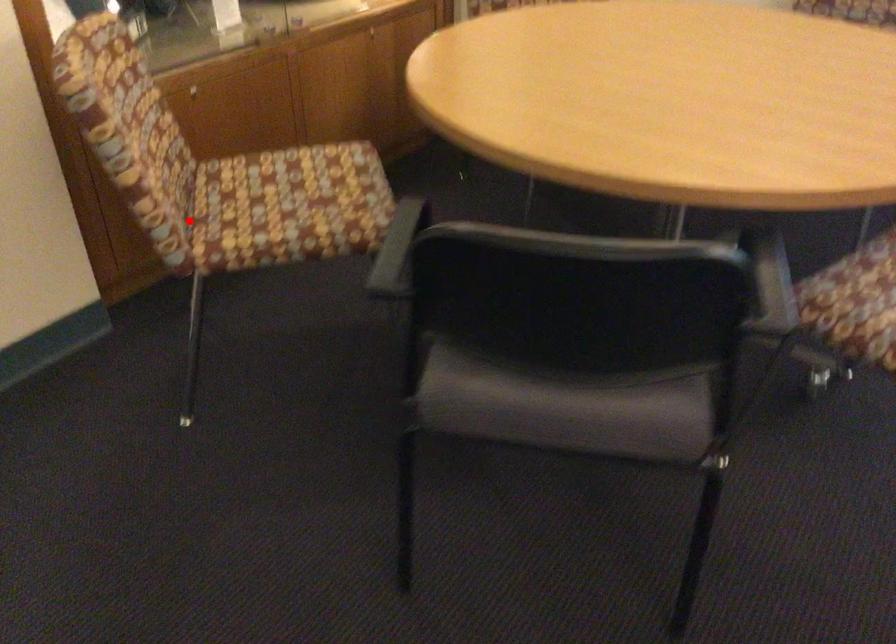
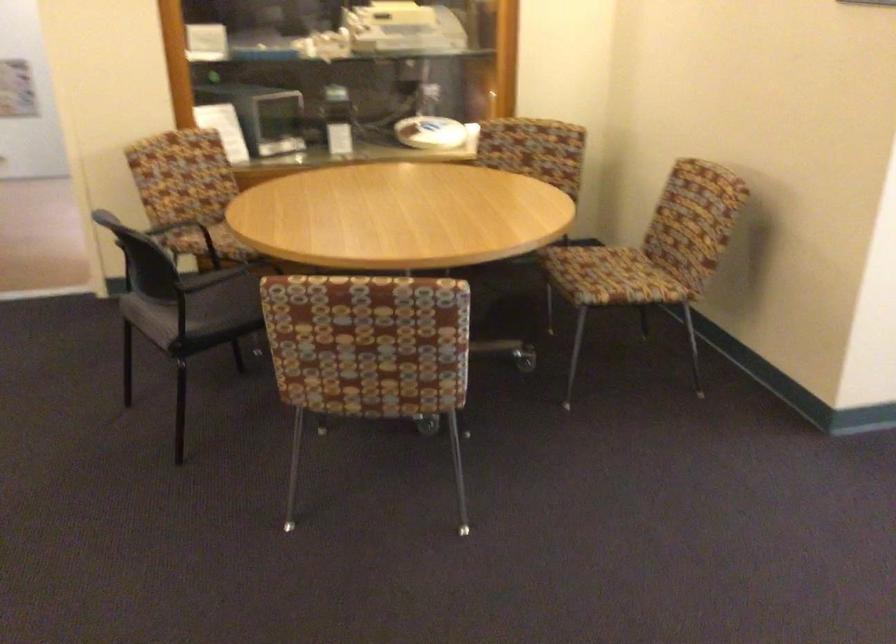
Question: A red point is marked in image1. In image2, is the corresponding 3D point closer to the camera or farther? Reply with the corresponding letter.

Choices:
 (A) The corresponding 3D point is closer.
 (B) The corresponding 3D point is farther.

Answer: (B)